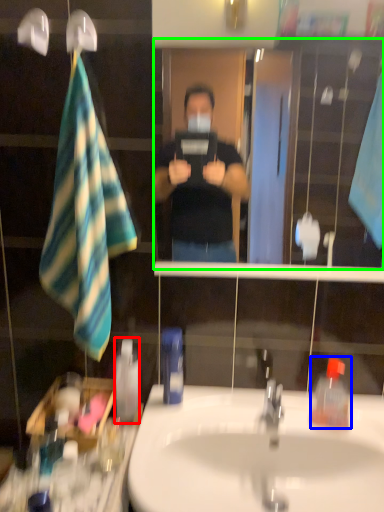
Question: Which object is positioned farthest from mouthwash (highlighted by a red box)? Select from toiletry (highlighted by a blue box) and mirror (highlighted by a green box).

Choices:
 (A) toiletry
 (B) mirror

Answer: (B)